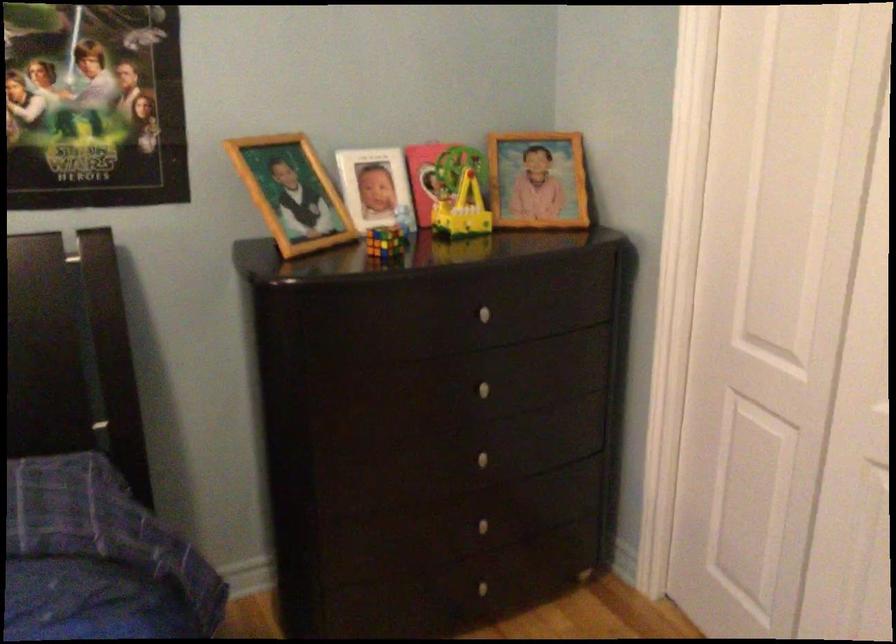
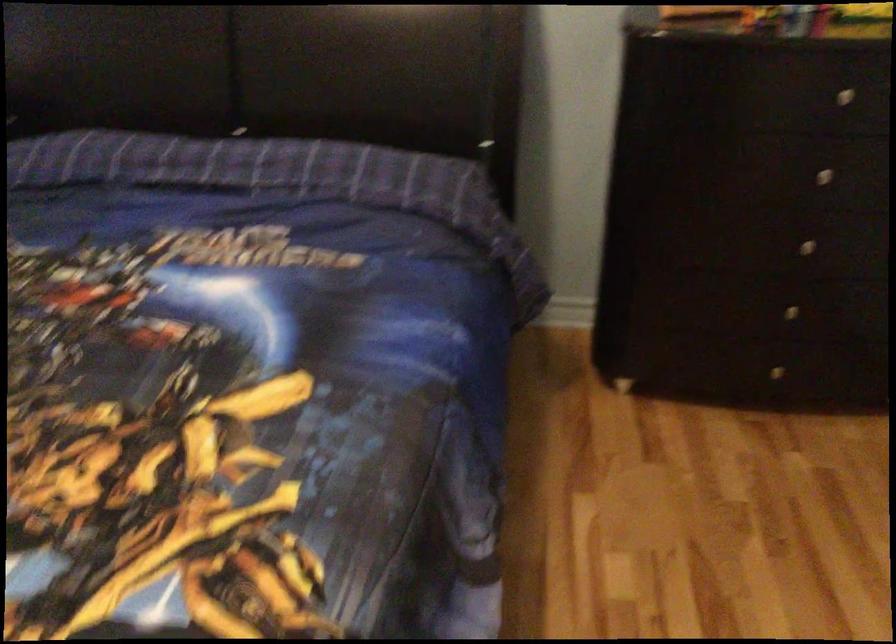
Locate, in the second image, the point that corresponds to (x=496, y=305) in the first image.

(858, 91)